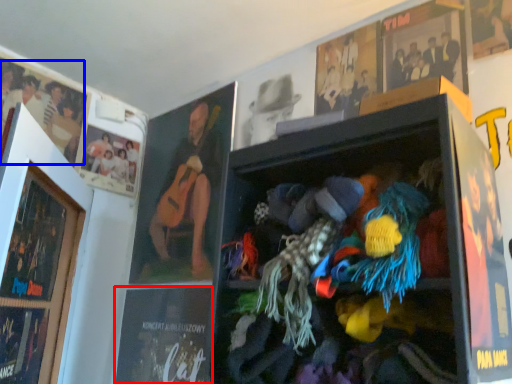
Question: Which point is closer to the camera, magazine (highlighted by a red box) or person (highlighted by a blue box)?

Choices:
 (A) magazine
 (B) person

Answer: (A)